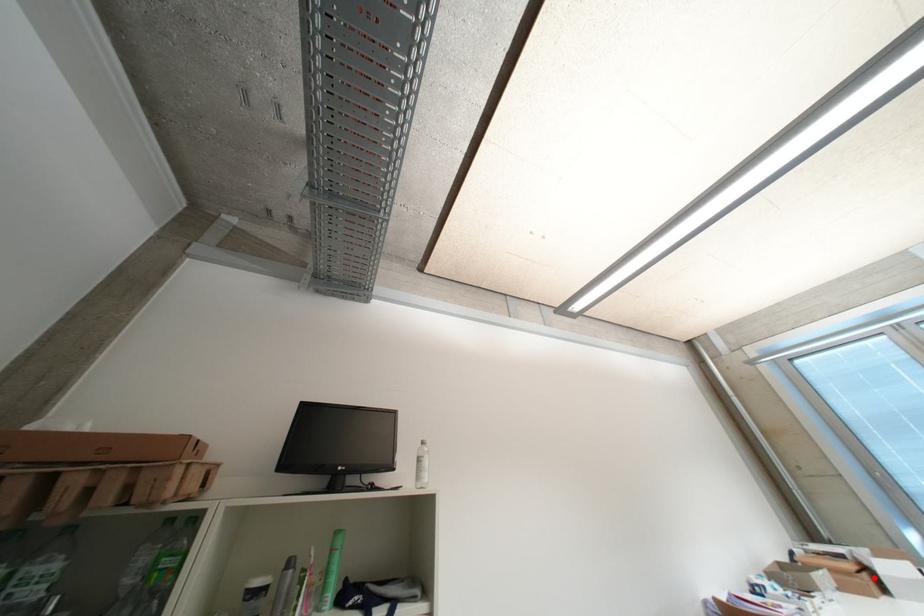
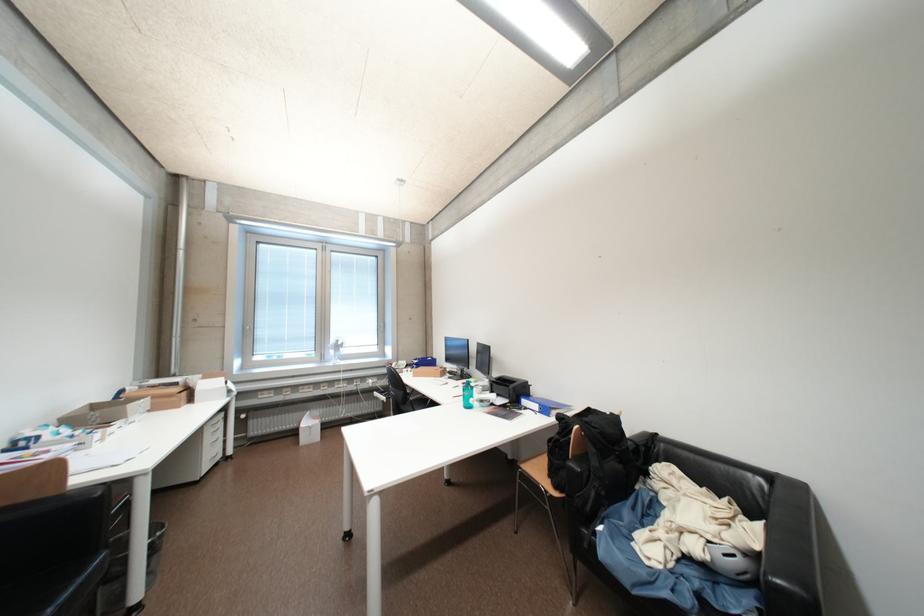
Where in the second image is the point corresponding to the highlighted location from the first image?

(192, 395)